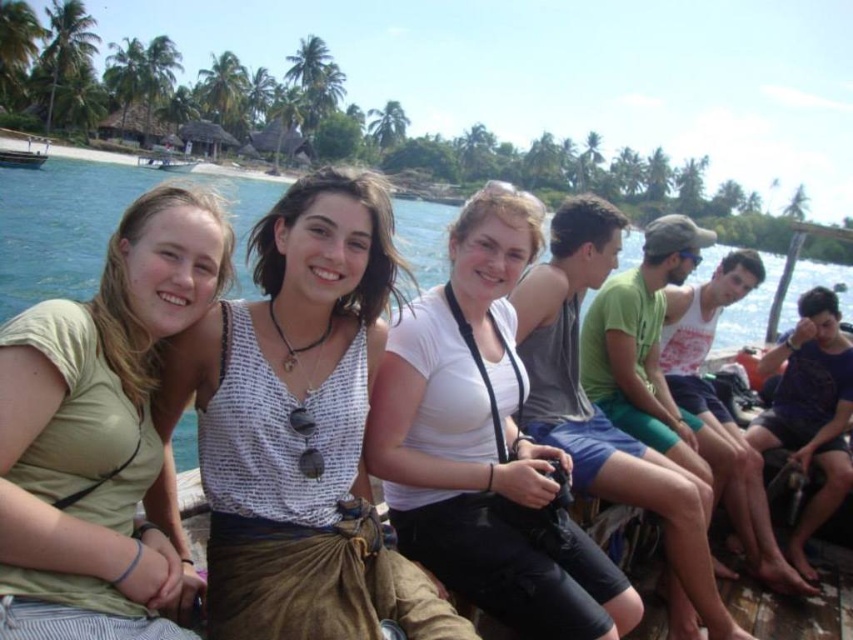
You are standing at the origin of the coordinate system in the image. You see two points, point (497, 224) and point (180, 154). Which point is closer to you?

Point (180, 154) is closer to you because it has a smaller y coordinate than point (497, 224), meaning it is positioned closer to the origin along the vertical axis.

You are a photographer trying to capture a group photo of the people in the scene. The green matte shirt at left is positioned at point (97, 429). Where should you position your camera to ensure the green matte shirt at left is centered in the photo?

To center the green matte shirt at left at point (97, 429), position the camera so that the center of the frame aligns with those coordinates.